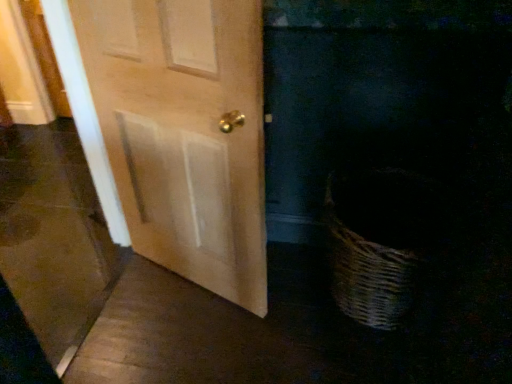
Question: In the image, is light wood door at center positioned in front of or behind matte wood screen door at left?

Choices:
 (A) front
 (B) behind

Answer: (B)

Question: Looking at the image, does light wood door at center seem bigger or smaller compared to matte wood screen door at left?

Choices:
 (A) small
 (B) big

Answer: (A)

Question: In terms of height, does light wood door at center look taller or shorter compared to matte wood screen door at left?

Choices:
 (A) short
 (B) tall

Answer: (A)

Question: From their relative heights in the image, would you say matte wood screen door at left is taller or shorter than light wood door at center?

Choices:
 (A) tall
 (B) short

Answer: (A)

Question: Looking at their shapes, would you say matte wood screen door at left is wider or thinner than light wood door at center?

Choices:
 (A) wide
 (B) thin

Answer: (A)

Question: Considering their positions, is matte wood screen door at left located in front of or behind light wood door at center?

Choices:
 (A) behind
 (B) front

Answer: (B)

Question: Considering the positions of point (70, 349) and point (202, 61), is point (70, 349) closer or farther from the camera than point (202, 61)?

Choices:
 (A) farther
 (B) closer

Answer: (A)